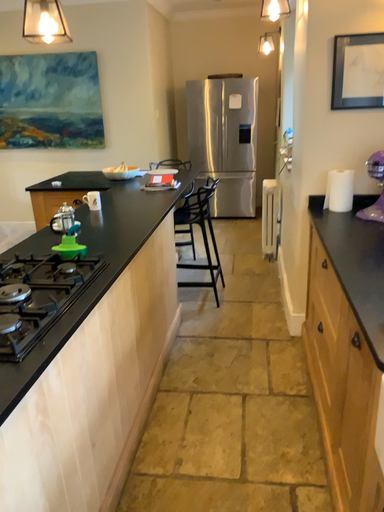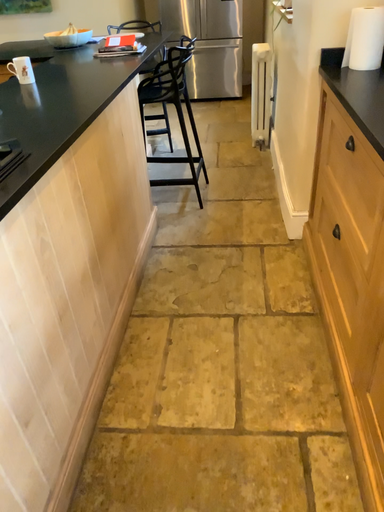
Question: Which way did the camera rotate in the video?

Choices:
 (A) rotated upward
 (B) rotated downward

Answer: (B)